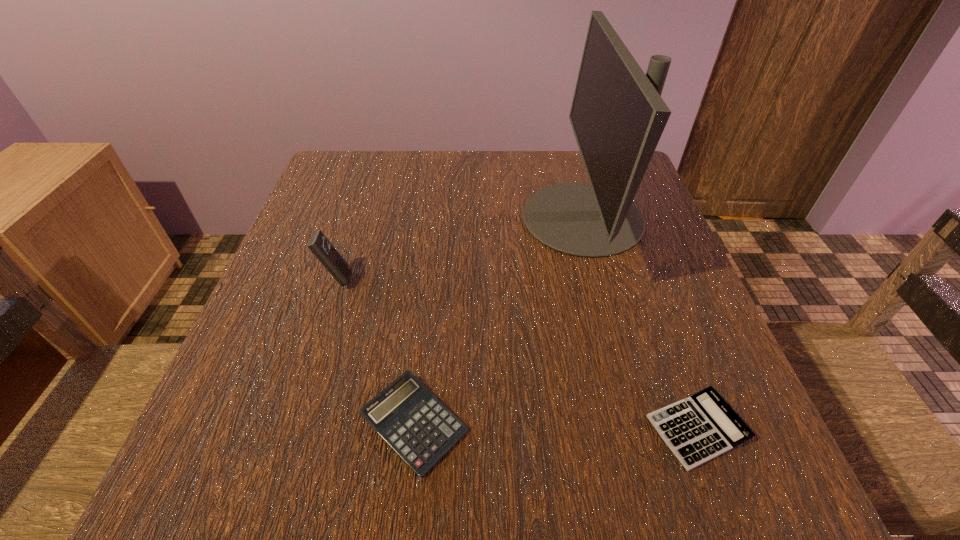
The image size is (960, 540). Identify the location of free space located on the front-facing side of the third shortest object. (420, 279).

Find the location of a particular element. vacant region located on the right of the second calculator from right to left is located at coordinates (654, 423).

Locate an element on the screen. vacant space situated on the back of the rightmost calculator is located at coordinates (635, 256).

This screenshot has width=960, height=540. Find the location of `object that is at the far edge`. object that is at the far edge is located at coordinates (617, 114).

Find the location of a particular element. This screenshot has height=540, width=960. object that is at the left edge is located at coordinates pos(319,245).

This screenshot has width=960, height=540. Identify the location of computer monitor that is at the right edge. (617, 114).

Where is `calculator that is at the right edge`? This screenshot has height=540, width=960. calculator that is at the right edge is located at coordinates (697, 429).

You are a GUI agent. You are given a task and a screenshot of the screen. Output one action in this format:
    pyautogui.click(x=<x>, y=<y>)
    Task: Click on the object at the far right corner
    The width and height of the screenshot is (960, 540).
    Given the screenshot: What is the action you would take?
    pyautogui.click(x=617, y=114)

Find the location of a particular element. The image size is (960, 540). object present at the near right corner is located at coordinates tap(697, 429).

In the image, there is a desktop. At what (x,y) coordinates should I click in order to perform the action: click on vacant space at the far edge. Please return your answer as a coordinate pair (x, y). Looking at the image, I should click on (398, 174).